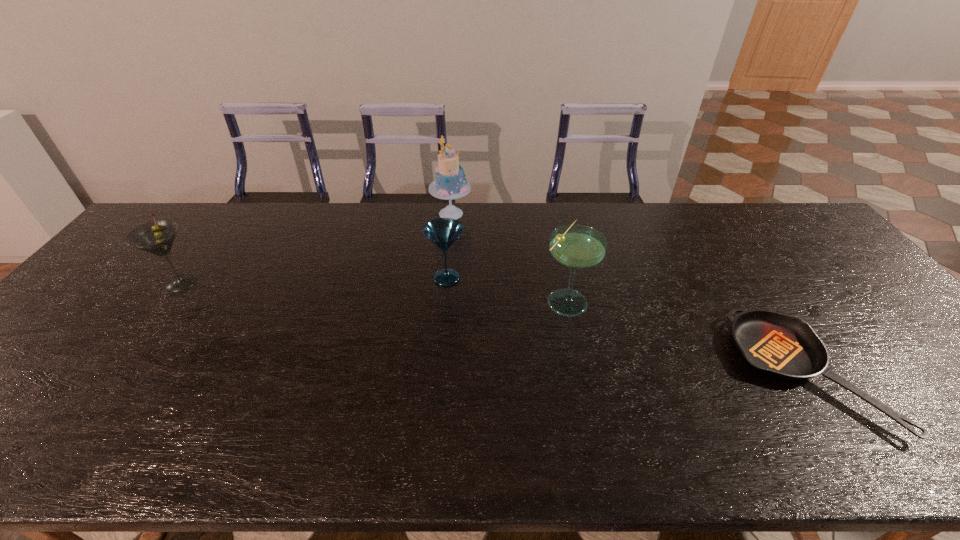
Identify which martini is the nearest to the tallest object. Please provide its 2D coordinates. Your answer should be formatted as a tuple, i.e. [(x, y)], where the tuple contains the x and y coordinates of a point satisfying the conditions above.

[(443, 232)]

Select which martini appears as the third closest to the tallest object. Please provide its 2D coordinates. Your answer should be formatted as a tuple, i.e. [(x, y)], where the tuple contains the x and y coordinates of a point satisfying the conditions above.

[(157, 237)]

The image size is (960, 540). I want to click on free space that satisfies the following two spatial constraints: 1. with a ladder on the side of the rightmost martini; 2. on the right side of the cake, so coord(444,300).

The width and height of the screenshot is (960, 540). I want to click on vacant position in the image that satisfies the following two spatial constraints: 1. on the front side of the leftmost martini; 2. on the right side of the fourth object from left to right, so click(169, 300).

You are a GUI agent. You are given a task and a screenshot of the screen. Output one action in this format:
    pyautogui.click(x=<x>, y=<y>)
    Task: Click on the free space that satisfies the following two spatial constraints: 1. with a ladder on the side of the tallest object; 2. on the left side of the shortest object
    This screenshot has height=540, width=960.
    Given the screenshot: What is the action you would take?
    pyautogui.click(x=437, y=373)

Identify the location of free spot that satisfies the following two spatial constraints: 1. on the front side of the second object from right to left; 2. on the right side of the leftmost object. This screenshot has height=540, width=960. (169, 300).

Where is `vacant position in the image that satisfies the following two spatial constraints: 1. with a ladder on the side of the rightmost object; 2. on the right side of the tallest object`? vacant position in the image that satisfies the following two spatial constraints: 1. with a ladder on the side of the rightmost object; 2. on the right side of the tallest object is located at coordinates (437, 373).

Where is `vacant space that satisfies the following two spatial constraints: 1. on the front side of the shortest martini; 2. on the left side of the fourth object from left to right`? Image resolution: width=960 pixels, height=540 pixels. vacant space that satisfies the following two spatial constraints: 1. on the front side of the shortest martini; 2. on the left side of the fourth object from left to right is located at coordinates (444, 300).

The width and height of the screenshot is (960, 540). Find the location of `free space that satisfies the following two spatial constraints: 1. with a ladder on the side of the second martini from right to left; 2. on the left side of the farthest object`. free space that satisfies the following two spatial constraints: 1. with a ladder on the side of the second martini from right to left; 2. on the left side of the farthest object is located at coordinates (445, 278).

You are a GUI agent. You are given a task and a screenshot of the screen. Output one action in this format:
    pyautogui.click(x=<x>, y=<y>)
    Task: Click on the vacant space that satisfies the following two spatial constraints: 1. on the front side of the second martini from left to right; 2. on the left side of the rightmost object
    
    Given the screenshot: What is the action you would take?
    pyautogui.click(x=439, y=373)